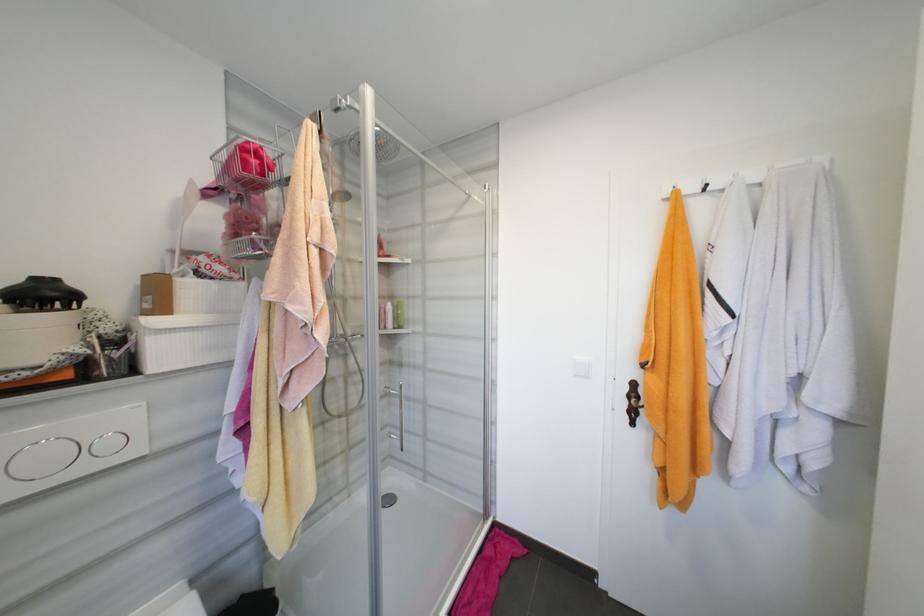
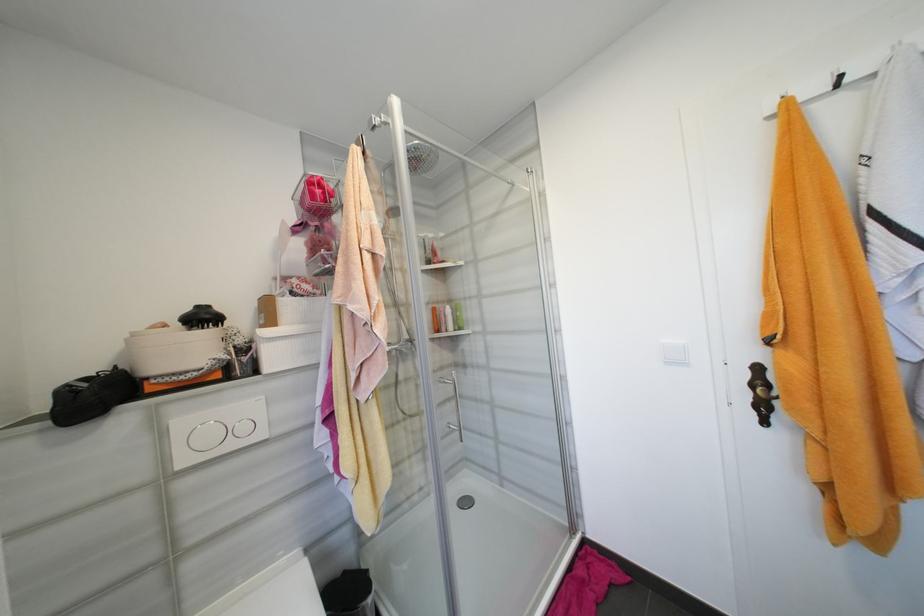
The point at (51, 296) is marked in the first image. Where is the corresponding point in the second image?

(210, 318)